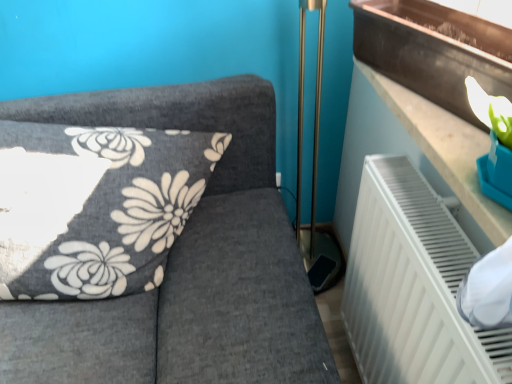
Question: Can you confirm if metallic brown window sill at upper right is thinner than dark gray fabric cushion at upper left?

Choices:
 (A) yes
 (B) no

Answer: (A)

Question: Is metallic brown window sill at upper right not close to dark gray fabric cushion at upper left?

Choices:
 (A) no
 (B) yes

Answer: (A)

Question: Considering the relative positions of metallic brown window sill at upper right and dark gray fabric cushion at upper left in the image provided, is metallic brown window sill at upper right to the left of dark gray fabric cushion at upper left from the viewer's perspective?

Choices:
 (A) no
 (B) yes

Answer: (A)

Question: Considering the relative positions of metallic brown window sill at upper right and dark gray fabric cushion at upper left in the image provided, is metallic brown window sill at upper right to the right of dark gray fabric cushion at upper left from the viewer's perspective?

Choices:
 (A) yes
 (B) no

Answer: (A)

Question: Considering the relative sizes of metallic brown window sill at upper right and dark gray fabric cushion at upper left in the image provided, is metallic brown window sill at upper right bigger than dark gray fabric cushion at upper left?

Choices:
 (A) yes
 (B) no

Answer: (B)

Question: Is metallic brown window sill at upper right positioned with its back to dark gray fabric cushion at upper left?

Choices:
 (A) yes
 (B) no

Answer: (B)

Question: Does dark gray fabric cushion at upper left have a lesser width compared to metallic brown window sill at upper right?

Choices:
 (A) yes
 (B) no

Answer: (B)

Question: Is dark gray fabric cushion at upper left positioned behind metallic brown window sill at upper right?

Choices:
 (A) no
 (B) yes

Answer: (B)

Question: Is dark gray fabric cushion at upper left wider than metallic brown window sill at upper right?

Choices:
 (A) no
 (B) yes

Answer: (B)

Question: Does dark gray fabric cushion at upper left appear on the right side of metallic brown window sill at upper right?

Choices:
 (A) yes
 (B) no

Answer: (B)

Question: Is dark gray fabric cushion at upper left positioned beyond the bounds of metallic brown window sill at upper right?

Choices:
 (A) yes
 (B) no

Answer: (A)

Question: From the image's perspective, does dark gray fabric cushion at upper left appear lower than metallic brown window sill at upper right?

Choices:
 (A) yes
 (B) no

Answer: (A)

Question: Is metallic brown window sill at upper right inside or outside of dark gray fabric cushion at upper left?

Choices:
 (A) outside
 (B) inside

Answer: (A)